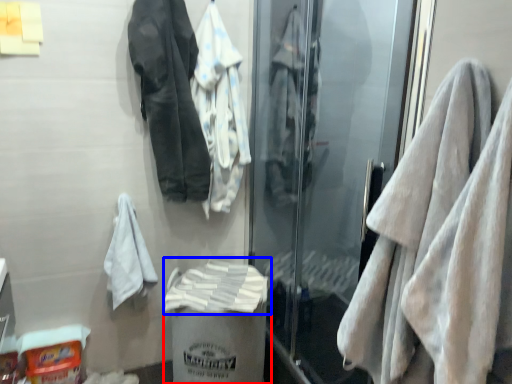
Question: Among these objects, which one is nearest to the camera, garbage (highlighted by a red box) or bath towel (highlighted by a blue box)?

Choices:
 (A) garbage
 (B) bath towel

Answer: (A)